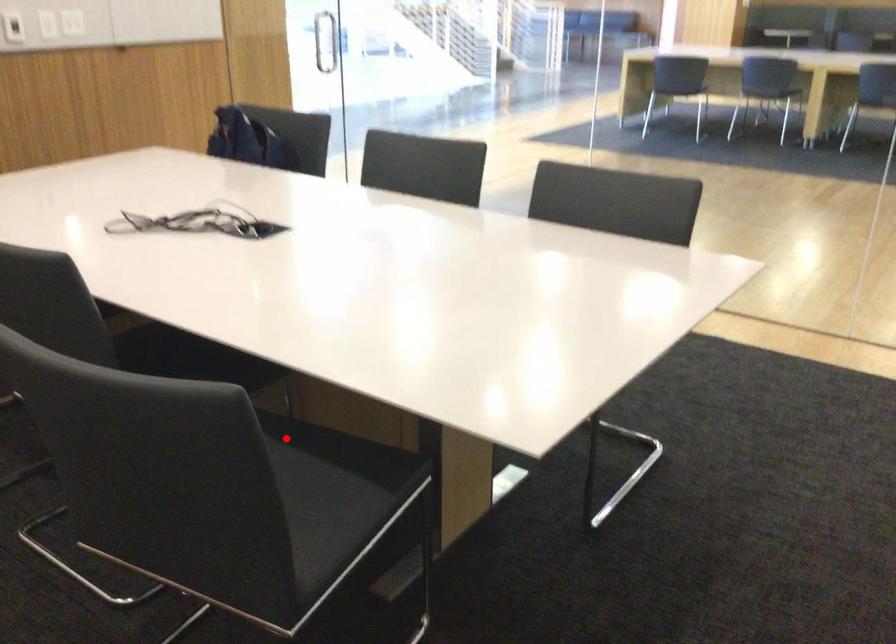
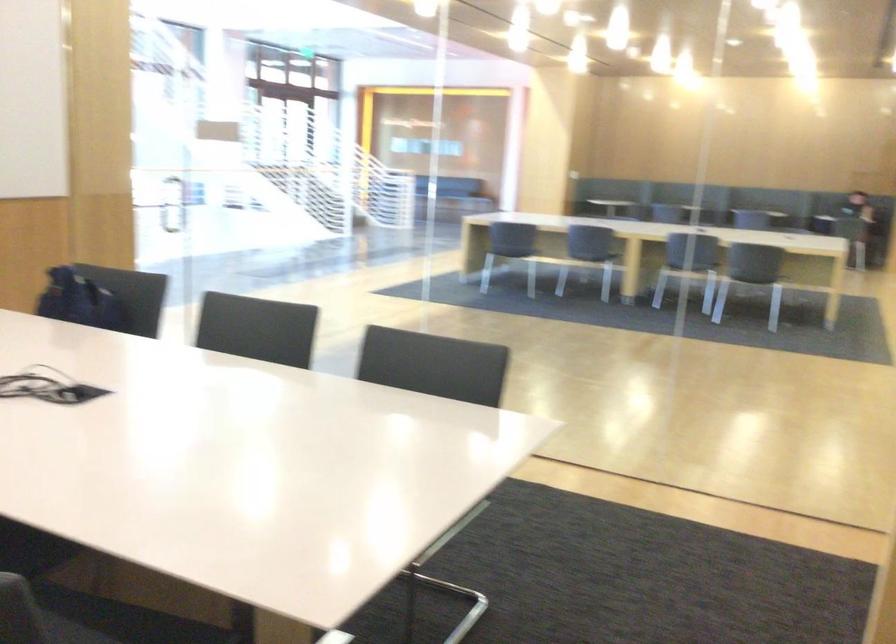
Where in the second image is the point corresponding to the highlighted location from the first image?

(88, 618)